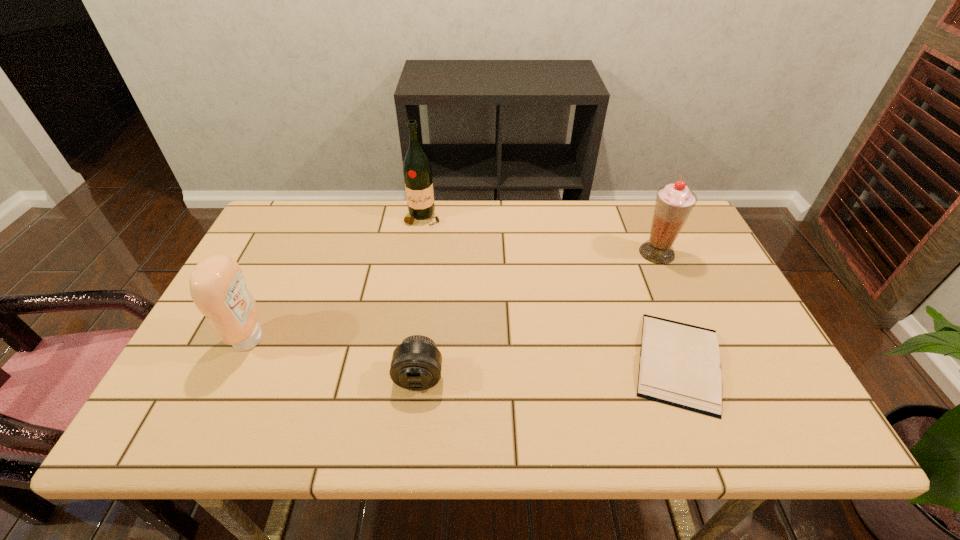
The height and width of the screenshot is (540, 960). Find the location of `unoccupied position between the condiment and the hardback book`. unoccupied position between the condiment and the hardback book is located at coordinates [x=464, y=350].

Find the location of a particular element. Image resolution: width=960 pixels, height=540 pixels. unoccupied position between the smoothie and the wine bottle is located at coordinates (540, 235).

This screenshot has height=540, width=960. What are the coordinates of `free spot between the fourth nearest object and the condiment` in the screenshot? It's located at (453, 296).

At what (x,y) coordinates should I click in order to perform the action: click on vacant area that lies between the hardback book and the condiment. Please return your answer as a coordinate pair (x, y). This screenshot has width=960, height=540. Looking at the image, I should click on (464, 350).

The image size is (960, 540). Find the location of `vacant area between the leftmost object and the farthest object`. vacant area between the leftmost object and the farthest object is located at coordinates (336, 278).

Identify which object is located as the nearest to the condiment. Please provide its 2D coordinates. Your answer should be formatted as a tuple, i.e. [(x, y)], where the tuple contains the x and y coordinates of a point satisfying the conditions above.

[(416, 364)]

Select which object is the second closest to the fourth nearest object. Please provide its 2D coordinates. Your answer should be formatted as a tuple, i.e. [(x, y)], where the tuple contains the x and y coordinates of a point satisfying the conditions above.

[(417, 172)]

Identify the location of free spot that satisfies the following two spatial constraints: 1. on the back side of the hardback book; 2. on the label of the condiment. The image size is (960, 540). (669, 339).

The width and height of the screenshot is (960, 540). I want to click on free space that satisfies the following two spatial constraints: 1. on the surface of the farthest object; 2. on the label of the leftmost object, so click(x=404, y=339).

This screenshot has width=960, height=540. I want to click on vacant area that satisfies the following two spatial constraints: 1. on the surface of the farthest object; 2. on the left side of the hardback book, so click(x=400, y=362).